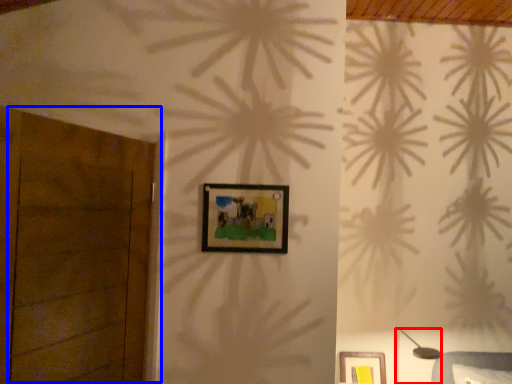
Question: Which object is closer to the camera taking this photo, table lamp (highlighted by a red box) or door (highlighted by a blue box)?

Choices:
 (A) table lamp
 (B) door

Answer: (B)